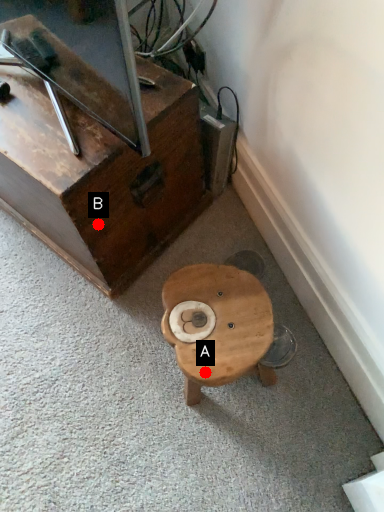
Question: Two points are circled on the image, labeled by A and B beside each circle. Among these points, which one is nearest to the camera?

Choices:
 (A) A is closer
 (B) B is closer

Answer: (A)